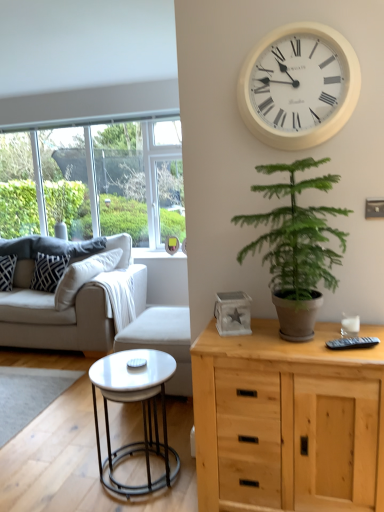
You are a GUI agent. You are given a task and a screenshot of the screen. Output one action in this format:
    pyautogui.click(x=<x>, y=<y>)
    Task: Click on the vacant space underneath green leafy plant at center-right (from a real-world perspective)
    The height and width of the screenshot is (512, 384).
    Given the screenshot: What is the action you would take?
    pyautogui.click(x=283, y=345)